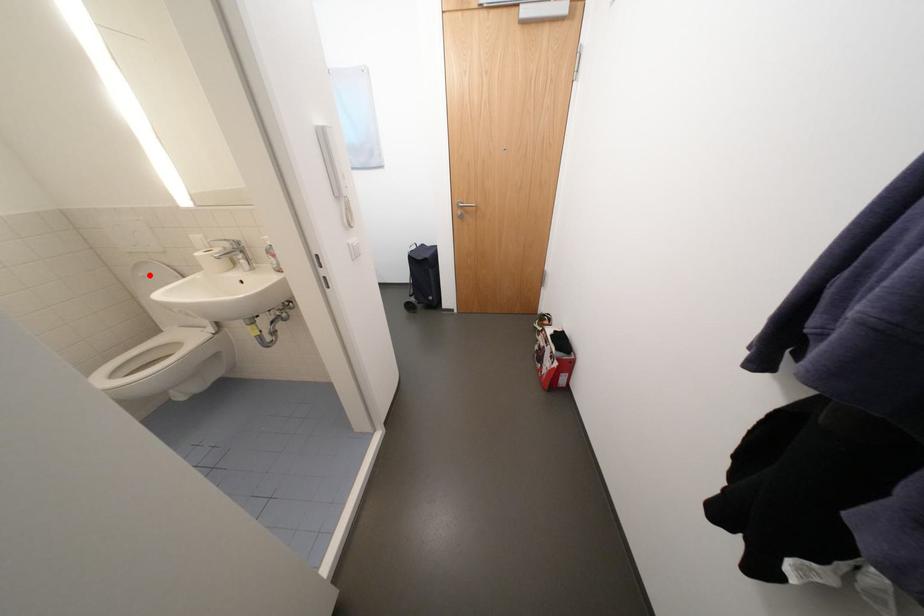
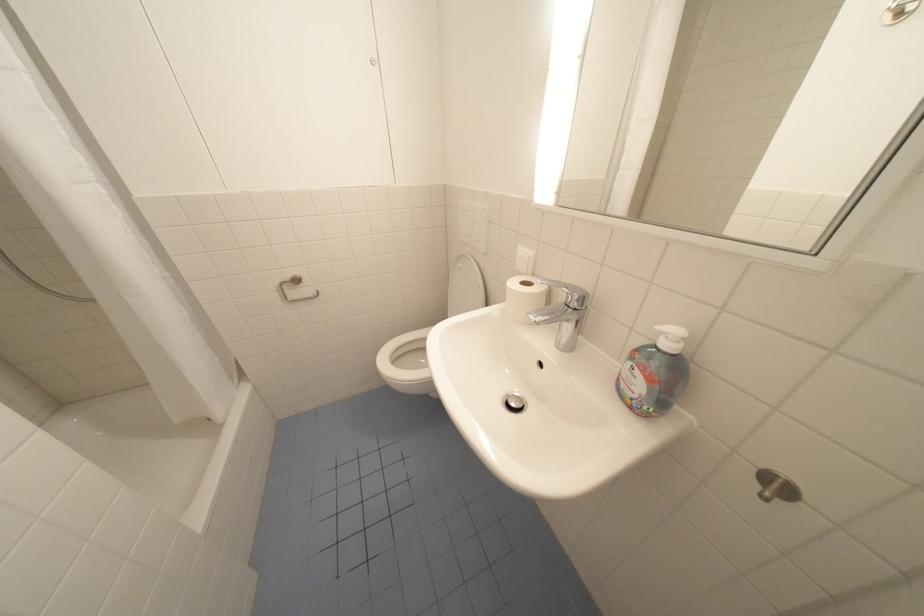
Locate, in the second image, the point that corresponds to the highlighted location in the first image.

(468, 265)